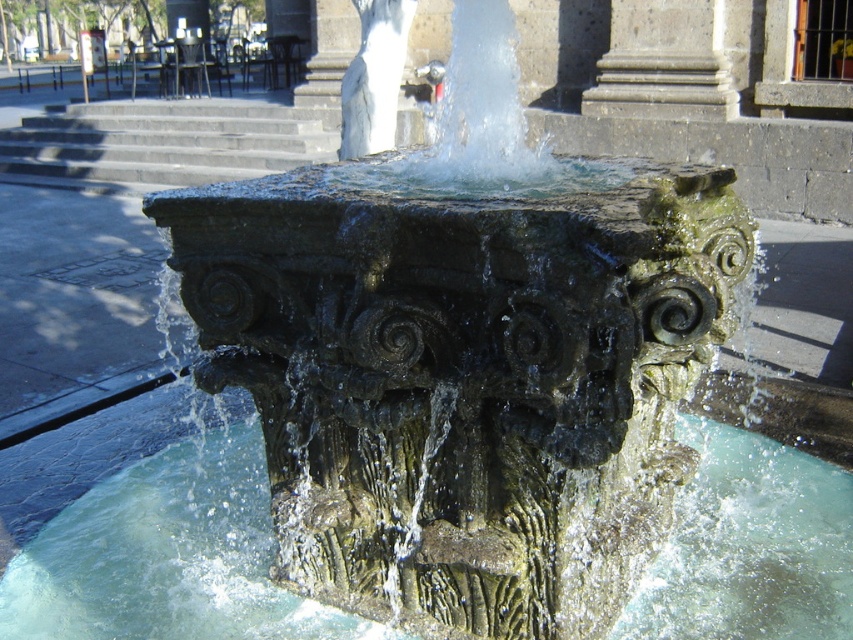
Question: Can you confirm if green mossy stone water at center is bigger than gray stone column at center?

Choices:
 (A) no
 (B) yes

Answer: (A)

Question: Which point is closer to the camera?

Choices:
 (A) green mossy stone water at center
 (B) gray stone column at center

Answer: (A)

Question: Considering the relative positions of green mossy stone water at center and gray stone column at center in the image provided, where is green mossy stone water at center located with respect to gray stone column at center?

Choices:
 (A) below
 (B) above

Answer: (A)

Question: Can you confirm if green mossy stone water at center is positioned to the right of gray stone column at center?

Choices:
 (A) yes
 (B) no

Answer: (B)